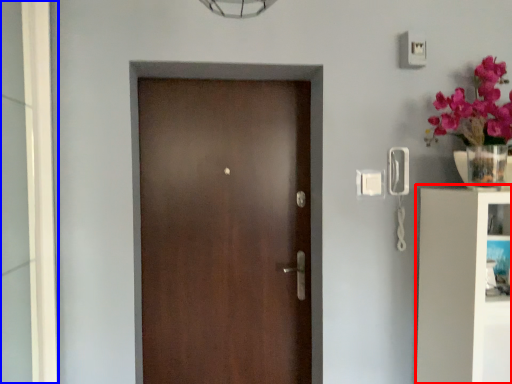
Question: Which object is closer to the camera taking this photo, bookshelf (highlighted by a red box) or glass door (highlighted by a blue box)?

Choices:
 (A) bookshelf
 (B) glass door

Answer: (B)